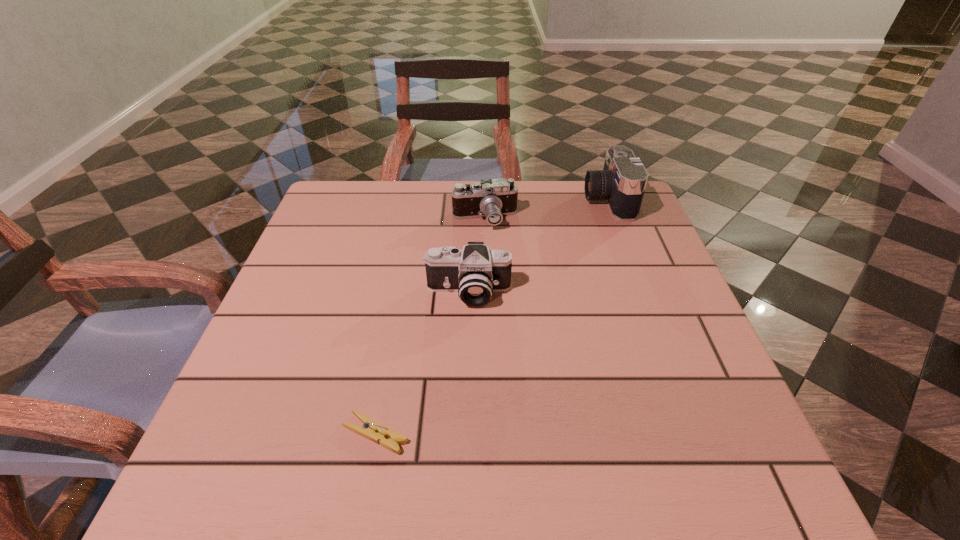
Locate an element on the screen. The height and width of the screenshot is (540, 960). object that is the third closest to the clothespin is located at coordinates (622, 182).

At what (x,y) coordinates should I click in order to perform the action: click on the third closest object to the clothespin. Please return your answer as a coordinate pair (x, y). Looking at the image, I should click on (622, 182).

This screenshot has width=960, height=540. In order to click on camera that stands as the closest to the nearest camera in this screenshot , I will do `click(492, 198)`.

Choose which camera is the second nearest neighbor to the nearest camera. Please provide its 2D coordinates. Your answer should be formatted as a tuple, i.e. [(x, y)], where the tuple contains the x and y coordinates of a point satisfying the conditions above.

[(622, 182)]

The height and width of the screenshot is (540, 960). Find the location of `vacant space that satisfies the following two spatial constraints: 1. on the back side of the shortest object; 2. on the right side of the nearest camera`. vacant space that satisfies the following two spatial constraints: 1. on the back side of the shortest object; 2. on the right side of the nearest camera is located at coordinates (401, 292).

Identify the location of vacant space that satisfies the following two spatial constraints: 1. on the front-facing side of the rightmost camera; 2. at the lens of the shortest camera. This screenshot has width=960, height=540. (615, 219).

Where is `vacant position in the image that satisfies the following two spatial constraints: 1. on the front-facing side of the rightmost camera; 2. on the front side of the nearest camera`? The height and width of the screenshot is (540, 960). vacant position in the image that satisfies the following two spatial constraints: 1. on the front-facing side of the rightmost camera; 2. on the front side of the nearest camera is located at coordinates click(643, 292).

At what (x,y) coordinates should I click in order to perform the action: click on free space that satisfies the following two spatial constraints: 1. on the back side of the shortest object; 2. on the right side of the third farthest object. Please return your answer as a coordinate pair (x, y). This screenshot has height=540, width=960. Looking at the image, I should click on (401, 292).